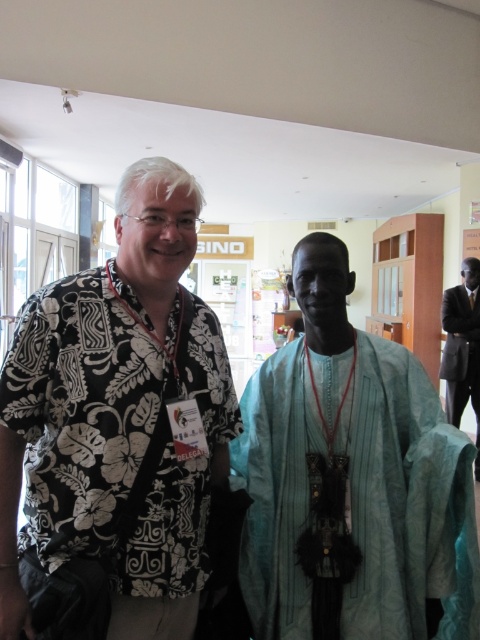
Question: Does black floral shirt at left appear on the right side of light blue fabric robe at center?

Choices:
 (A) yes
 (B) no

Answer: (B)

Question: Considering the relative positions of black floral shirt at left and light blue fabric robe at center in the image provided, where is black floral shirt at left located with respect to light blue fabric robe at center?

Choices:
 (A) below
 (B) above

Answer: (B)

Question: Which of the following is the closest to the observer?

Choices:
 (A) black suit at right
 (B) light blue fabric robe at center

Answer: (B)

Question: Which of the following is the farthest from the observer?

Choices:
 (A) light blue fabric robe at center
 (B) black suit at right
 (C) black floral shirt at left

Answer: (B)

Question: Is black floral shirt at left further to the viewer compared to black suit at right?

Choices:
 (A) no
 (B) yes

Answer: (A)

Question: Among these objects, which one is nearest to the camera?

Choices:
 (A) black suit at right
 (B) black floral shirt at left
 (C) light blue fabric robe at center

Answer: (B)